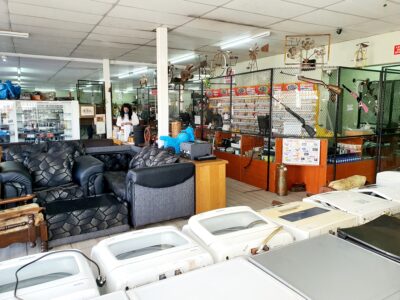
You are a GUI agent. You are given a task and a screenshot of the screen. Output one action in this format:
    pyautogui.click(x=<x>, y=<y>)
    Task: Click on the chair arms
    
    Given the screenshot: What is the action you would take?
    pyautogui.click(x=17, y=200), pyautogui.click(x=27, y=212), pyautogui.click(x=11, y=173), pyautogui.click(x=95, y=167), pyautogui.click(x=111, y=152), pyautogui.click(x=165, y=169)